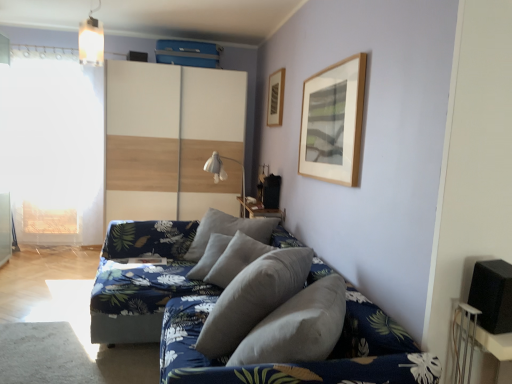
Question: Does gray fabric pillow at center, which is the first pillow from back to front, have a lesser height compared to white matte window screen at left?

Choices:
 (A) no
 (B) yes

Answer: (B)

Question: Can you confirm if gray fabric pillow at center, arranged as the 2th pillow when viewed from the front, is thinner than white matte window screen at left?

Choices:
 (A) yes
 (B) no

Answer: (B)

Question: Is the depth of gray fabric pillow at center, which is the first pillow from back to front, greater than that of white matte window screen at left?

Choices:
 (A) yes
 (B) no

Answer: (B)

Question: Does gray fabric pillow at center, which is the first pillow from back to front, have a greater width compared to white matte window screen at left?

Choices:
 (A) no
 (B) yes

Answer: (B)

Question: Are gray fabric pillow at center, which is the first pillow from back to front, and white matte window screen at left far apart?

Choices:
 (A) no
 (B) yes

Answer: (B)

Question: Does gray fabric pillow at center, arranged as the 2th pillow when viewed from the front, turn towards white matte window screen at left?

Choices:
 (A) no
 (B) yes

Answer: (A)

Question: Is gray fabric pillow at center, the second pillow viewed from the back, taller than metallic pendant light at upper center?

Choices:
 (A) no
 (B) yes

Answer: (B)

Question: Can we say gray fabric pillow at center, the second pillow viewed from the back, lies outside metallic pendant light at upper center?

Choices:
 (A) yes
 (B) no

Answer: (A)

Question: Could you tell me if gray fabric pillow at center, the second pillow viewed from the back, is turned towards metallic pendant light at upper center?

Choices:
 (A) yes
 (B) no

Answer: (B)

Question: Is metallic pendant light at upper center at the back of gray fabric pillow at center, the second pillow viewed from the back?

Choices:
 (A) no
 (B) yes

Answer: (A)

Question: Is gray fabric pillow at center, placed as the 1th pillow when sorted from front to back, thinner than metallic pendant light at upper center?

Choices:
 (A) yes
 (B) no

Answer: (B)

Question: Are gray fabric pillow at center, placed as the 1th pillow when sorted from front to back, and metallic pendant light at upper center making contact?

Choices:
 (A) no
 (B) yes

Answer: (A)

Question: Is white fabric lampshade at center to the right of white wood dresser at center from the viewer's perspective?

Choices:
 (A) no
 (B) yes

Answer: (B)